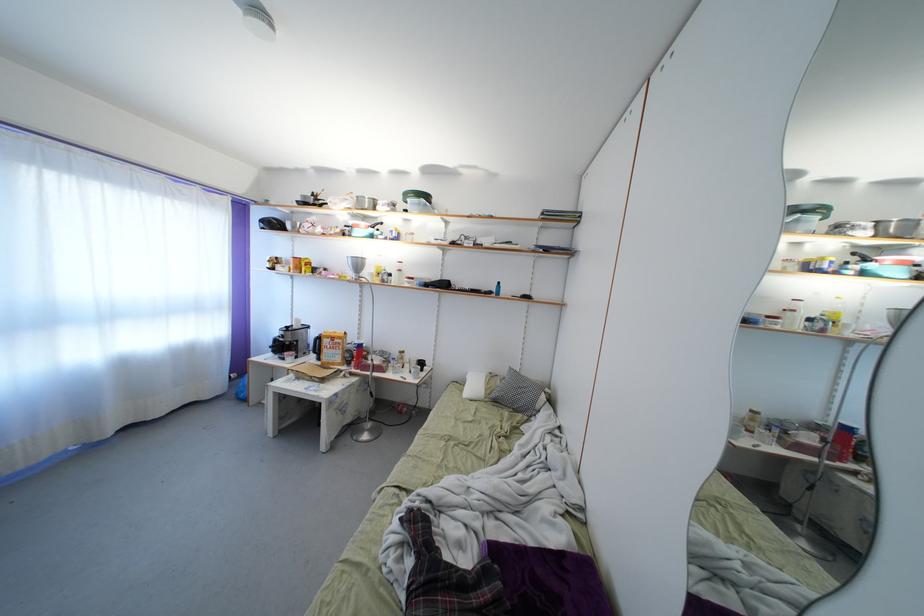
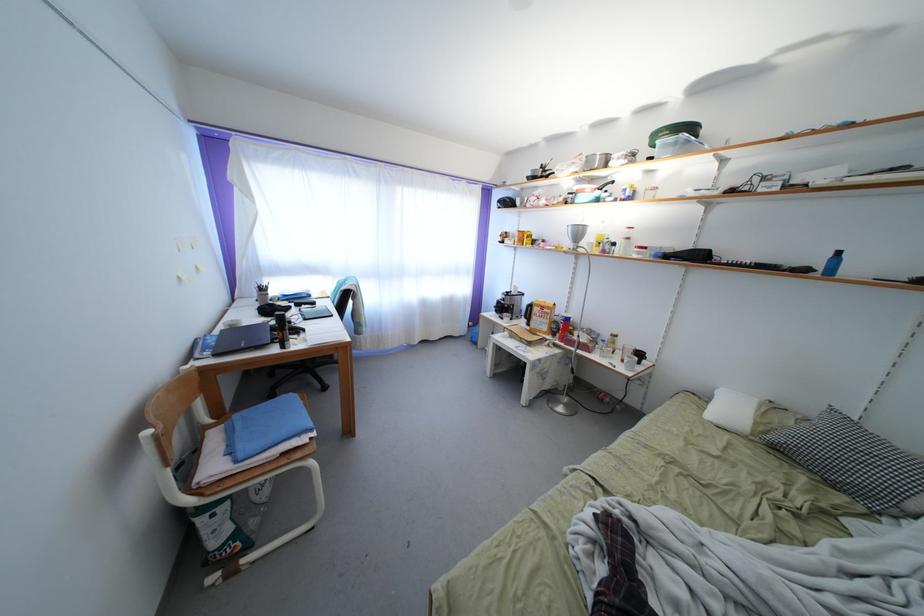
Where in the second image is the point corresponding to the point at 501,296 from the first image?

(823, 272)